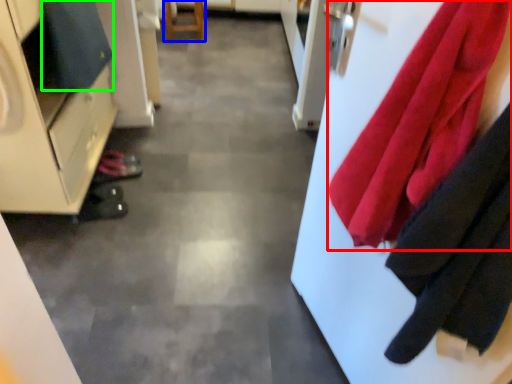
Question: Which object is the farthest from cloth (highlighted by a red box)? Choose among these: furniture (highlighted by a blue box) or cloak (highlighted by a green box).

Choices:
 (A) furniture
 (B) cloak

Answer: (A)